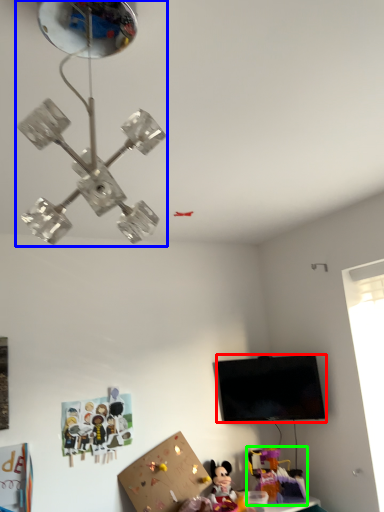
Question: Based on their relative distances, which object is farther from television (highlighted by a red box)? Choose from lamp (highlighted by a blue box) and toy (highlighted by a green box).

Choices:
 (A) lamp
 (B) toy

Answer: (A)